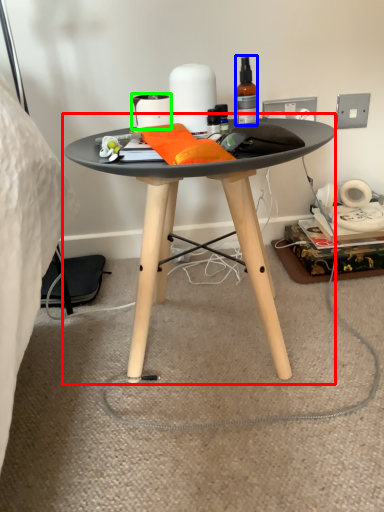
Question: Estimate the real-world distances between objects in this image. Which object is farther from coffee table (highlighted by a red box), bottle (highlighted by a blue box) or toilet paper (highlighted by a green box)?

Choices:
 (A) bottle
 (B) toilet paper

Answer: (A)